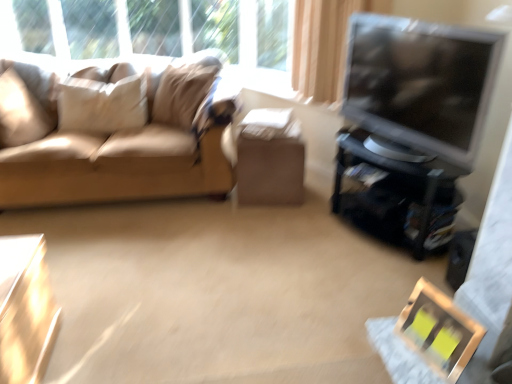
The image size is (512, 384). What are the coordinates of `vacant space behind shiny metallic table at lower left, placed as the 1th table when sorted from front to back` in the screenshot? It's located at (92, 299).